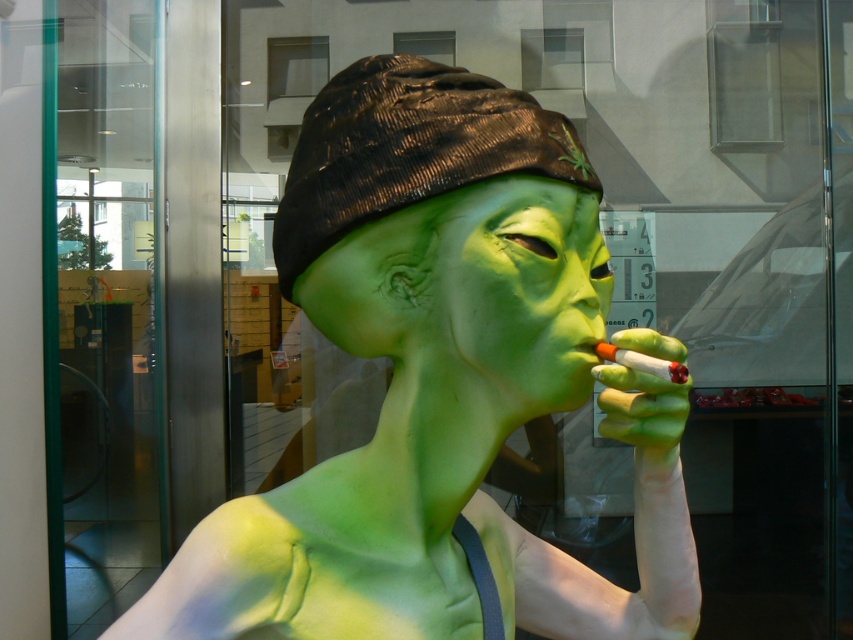
You are an interior designer assessing the layout of the space shown. You notice the black textured beanie at upper center and the green matte mask at center. Which object is positioned higher in the image?

The black textured beanie at upper center is positioned higher than the green matte mask at center.

Consider the image. You are an interior designer assessing the layout of this space. You notice the black textured beanie at upper center and the green matte mask at center. Which object is closer to the viewer?

The black textured beanie at upper center is closer to the viewer because it is positioned in front of the green matte mask at center.